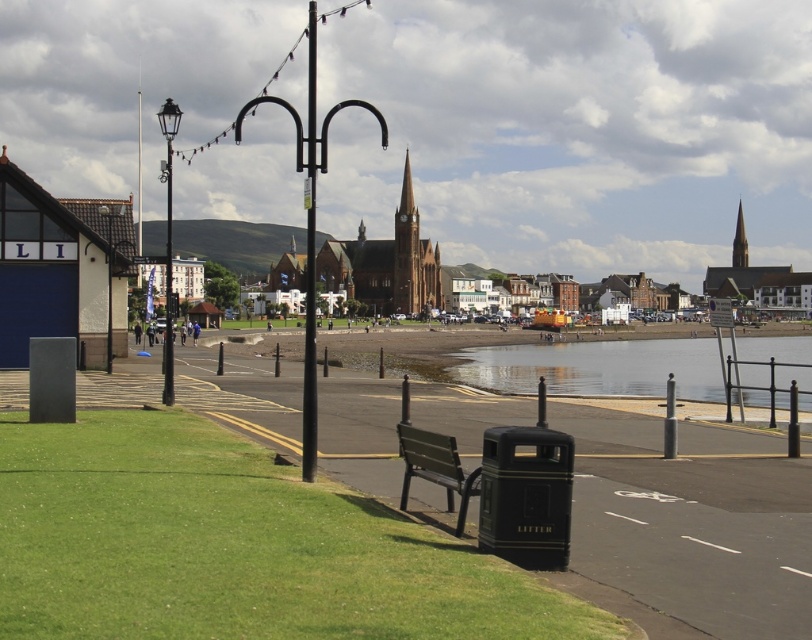
Question: Which of the following is the farthest from the observer?

Choices:
 (A) metallic pole at center
 (B) wooden bench at center

Answer: (A)

Question: Is wooden bench at center positioned in front of smooth stone spire at upper right?

Choices:
 (A) no
 (B) yes

Answer: (B)

Question: Which point appears farthest from the camera in this image?

Choices:
 (A) (167, 204)
 (B) (396, 212)
 (C) (741, 257)

Answer: (C)

Question: Which object is closer to the camera taking this photo?

Choices:
 (A) brown stone spire at center
 (B) metallic pole at center

Answer: (B)

Question: Can you confirm if clear water at lower center is positioned to the left of smooth stone spire at upper right?

Choices:
 (A) no
 (B) yes

Answer: (B)

Question: Where is metallic pole at center located in relation to wooden bench at center in the image?

Choices:
 (A) below
 (B) above

Answer: (B)